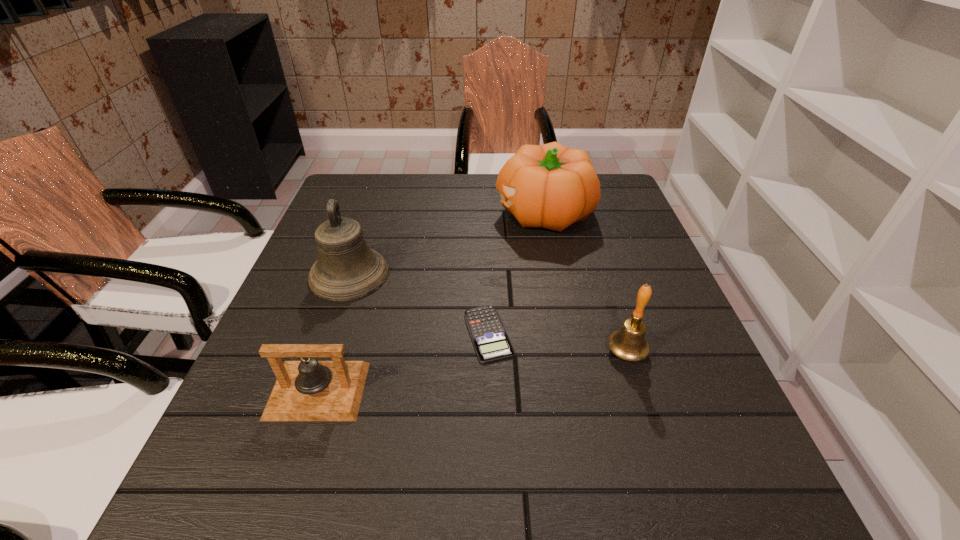
At what (x,y) coordinates should I click in order to perform the action: click on vacant point located on the back of the second shortest object. Please return your answer as a coordinate pair (x, y). The image size is (960, 540). Looking at the image, I should click on (348, 296).

Identify the location of free location located on the back of the calculator. Image resolution: width=960 pixels, height=540 pixels. 487,228.

Locate an element on the screen. This screenshot has width=960, height=540. object present at the far edge is located at coordinates (551, 186).

This screenshot has height=540, width=960. In order to click on pumpkin positioned at the right edge in this screenshot , I will do `click(551, 186)`.

Where is `bell located in the right edge section of the desktop`? This screenshot has height=540, width=960. bell located in the right edge section of the desktop is located at coordinates (629, 343).

Identify the location of object at the far right corner. The image size is (960, 540). (551, 186).

This screenshot has height=540, width=960. In order to click on vacant region at the far edge in this screenshot , I will do `click(470, 189)`.

Locate an element on the screen. vacant space at the near edge is located at coordinates [x=353, y=526].

Identify the location of blank space at the left edge. (324, 342).

Identify the location of vacant space at the right edge of the desktop. (651, 254).